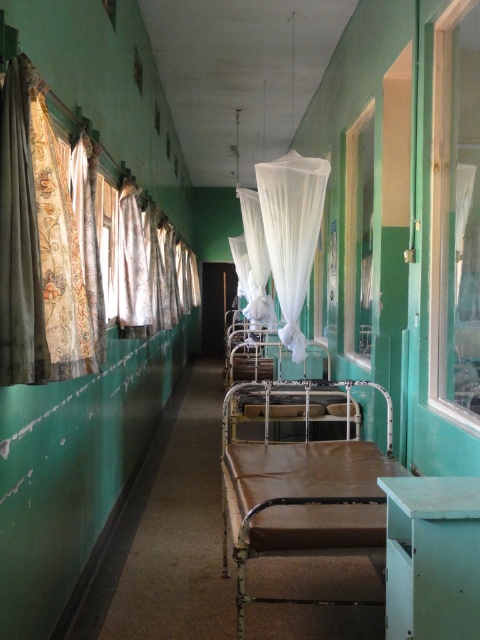
You are a nurse in a hospital corridor. You need to adjust the curtains to let more light in. Which curtain should you pull down first, the patterned fabric curtain at left or the textured beige curtain at left?

The patterned fabric curtain at left is located above the textured beige curtain at left, so you should pull down the patterned fabric curtain at left first to let more light in.

You are a nurse pushing a medical cart that is 1.2 meters wide. You need to move through the corridor and pass between the textured beige curtain at left and the white sheer curtain at center. Can your cart fit through the space between them?

The textured beige curtain at left is in front of the white sheer curtain at center, meaning they are positioned along the same plane. Since both curtains are on the same side of the corridor, there is no space between them for the cart to pass through. The nurse should find an alternative route.

You are a nurse walking down the corridor and need to adjust both the patterned fabric curtain at left and the textured beige curtain at left. Which curtain should you adjust first if you want to start with the one closest to you?

You should adjust the patterned fabric curtain at left first because it is closer to you than the textured beige curtain at left.